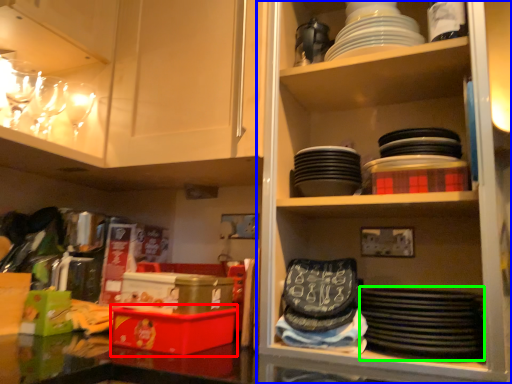
Question: Which is farther away from box (highlighted by a red box)? shelf (highlighted by a blue box) or platter (highlighted by a green box)?

Choices:
 (A) shelf
 (B) platter

Answer: (A)